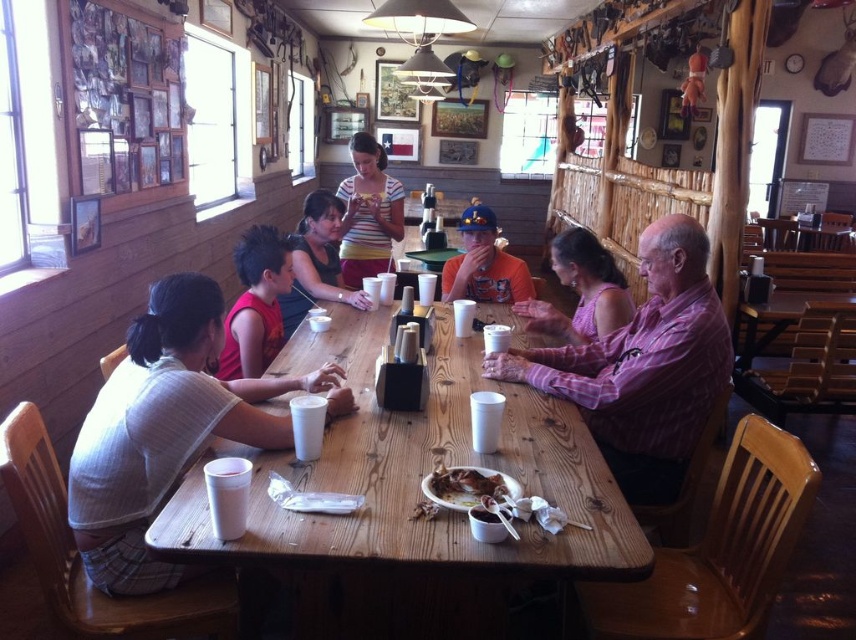
Does white striped shirt at left appear under orange cotton shirt at center?

Correct, white striped shirt at left is located below orange cotton shirt at center.

Locate an element on the screen. This screenshot has width=856, height=640. white striped shirt at left is located at coordinates (167, 429).

Does point (128, 534) lie in front of point (504, 280)?

Yes, it is in front of point (504, 280).

You are a GUI agent. You are given a task and a screenshot of the screen. Output one action in this format:
    pyautogui.click(x=<x>, y=<y>)
    Task: Click on the white striped shirt at left
    Image resolution: width=856 pixels, height=640 pixels.
    Given the screenshot: What is the action you would take?
    pyautogui.click(x=167, y=429)

Is point (574, 269) positioned before point (388, 204)?

Yes, it is.

Which is below, pink satin blouse at center or striped cotton shirt at center?

pink satin blouse at center is lower down.

Where is `pink satin blouse at center`? pink satin blouse at center is located at coordinates 581,291.

Is point (141, 426) positioned before point (312, 230)?

Yes.

Image resolution: width=856 pixels, height=640 pixels. Find the location of `white striped shirt at left`. white striped shirt at left is located at coordinates (167, 429).

Does point (86, 452) come closer to viewer compared to point (337, 296)?

Yes, it is in front of point (337, 296).

This screenshot has width=856, height=640. Find the location of `white striped shirt at left`. white striped shirt at left is located at coordinates (167, 429).